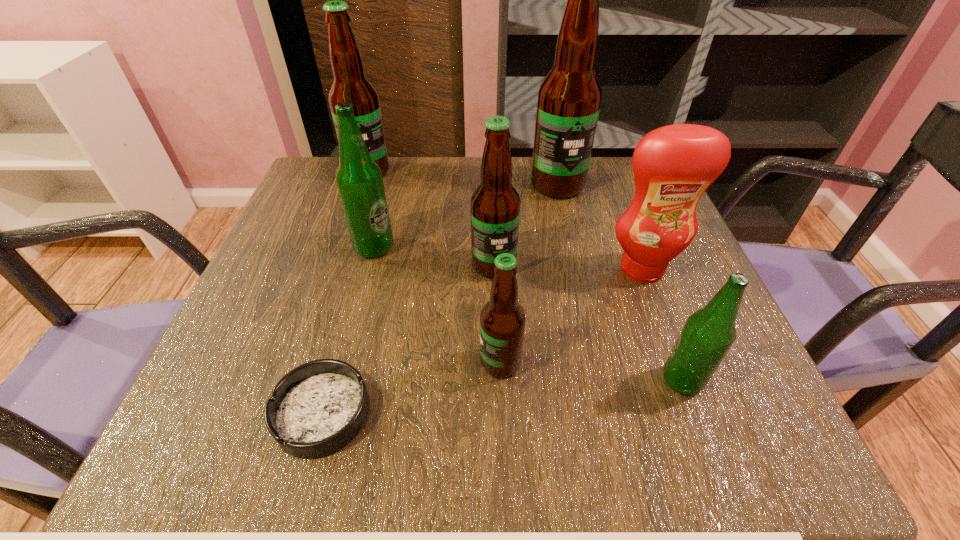
This screenshot has width=960, height=540. In order to click on vacant space situated on the label of the smallest brown beer bottle in this screenshot , I will do `click(437, 362)`.

The height and width of the screenshot is (540, 960). I want to click on free spot located 0.260m on the label of the nearer green beer bottle, so click(x=494, y=381).

The width and height of the screenshot is (960, 540). In order to click on blank space located on the label of the nearer green beer bottle in this screenshot , I will do `click(437, 381)`.

Where is `free location located on the label of the nearer green beer bottle`? The width and height of the screenshot is (960, 540). free location located on the label of the nearer green beer bottle is located at coordinates (404, 381).

I want to click on free space located on the back of the shortest object, so click(362, 268).

Where is `object situated at the near edge`? object situated at the near edge is located at coordinates (317, 408).

This screenshot has width=960, height=540. What are the coordinates of `beer bottle that is at the left edge` in the screenshot? It's located at (350, 85).

Where is `ashtray at the left edge`? This screenshot has height=540, width=960. ashtray at the left edge is located at coordinates (317, 408).

Identify the location of condiment present at the right edge. (673, 166).

The image size is (960, 540). I want to click on beer bottle at the right edge, so click(708, 334).